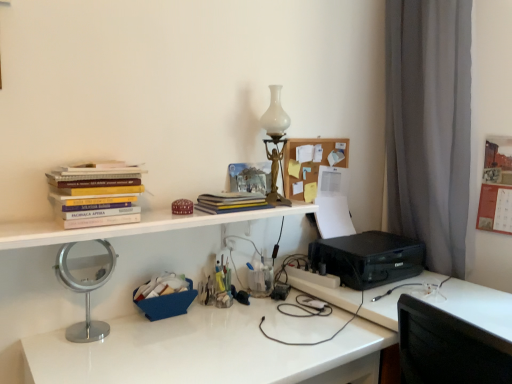
Locate an element on the screen. This screenshot has height=384, width=512. vacant space to the right of silver metallic mirror at lower left is located at coordinates (140, 341).